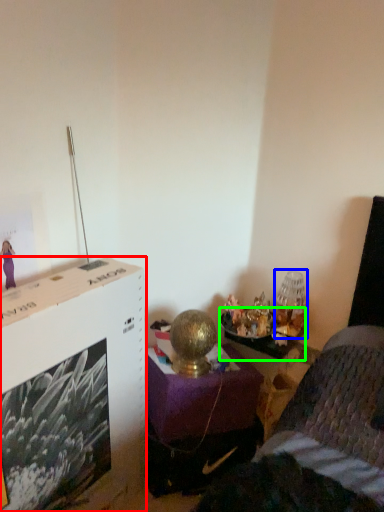
Question: Based on their relative distances, which object is farther from file cabinet (highlighted by a red box)? Choose from table lamp (highlighted by a blue box) and table (highlighted by a green box).

Choices:
 (A) table lamp
 (B) table

Answer: (A)